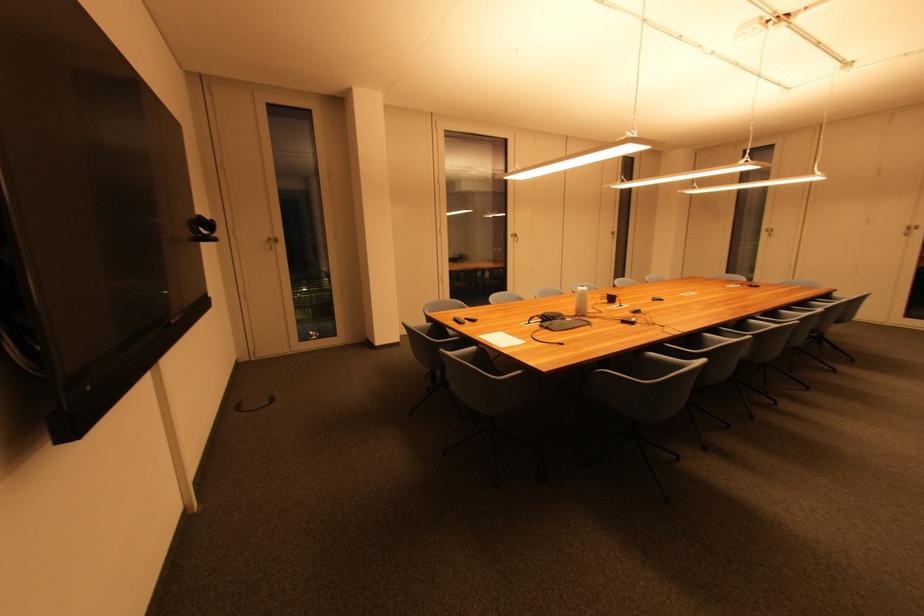
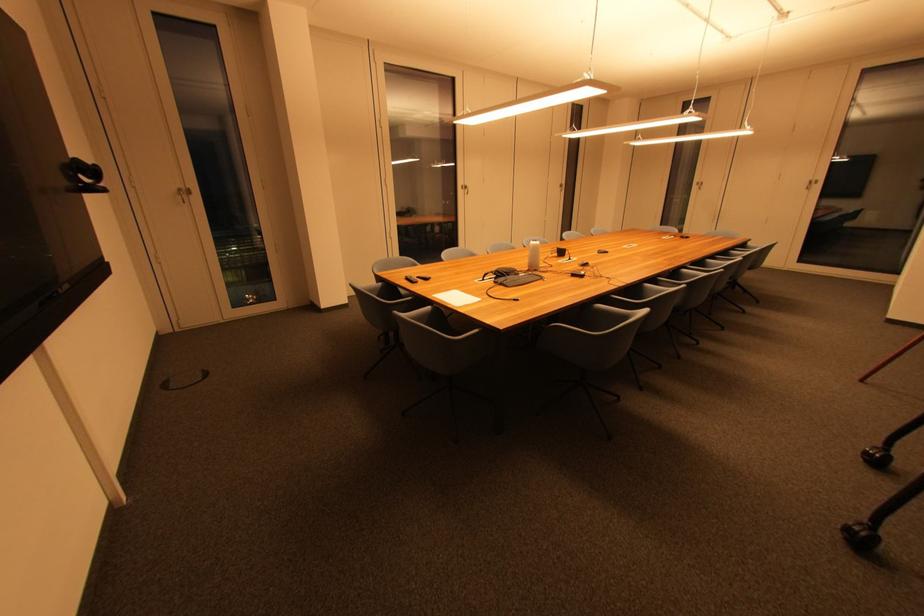
Locate, in the second image, the point that corresponds to (x=629, y=323) in the first image.

(578, 277)